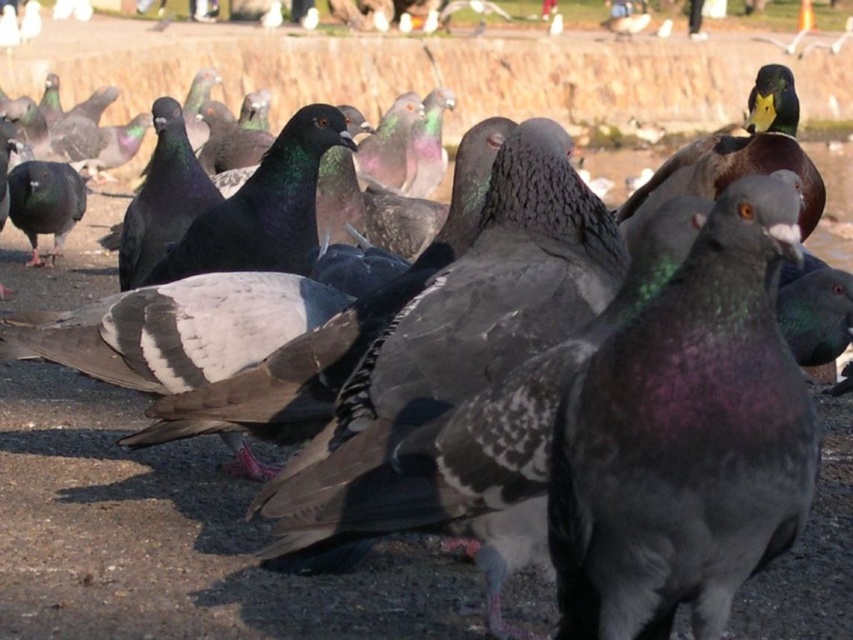
You are a photographer aiming to capture a closeup shot of the shiny gray pigeon at center and the green glossy duck at upper right in the same frame. Your camera has a maximum focus range of 8 feet. Can you fit both subjects within the camera frame without moving your position?

The distance between the shiny gray pigeon at center and the green glossy duck at upper right is 8.13 feet. Since your camera can only focus up to 8 feet, you cannot fit both subjects within the camera frame without moving your position.

You are a photographer trying to capture a shot of the shiny gray pigeon at center and the green glossy duck at upper right. From your current position, which bird is positioned to the left of the other?

The shiny gray pigeon at center is positioned to the left of the green glossy duck at upper right.